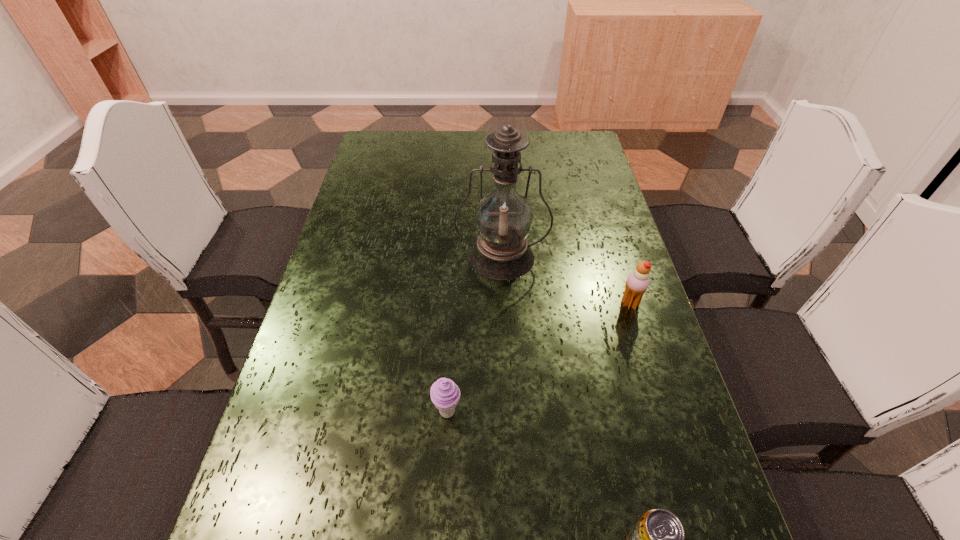
Where is `the tallest object`? the tallest object is located at coordinates (503, 218).

At what (x,y) coordinates should I click in order to perform the action: click on oil lamp. Please return your answer as a coordinate pair (x, y). This screenshot has height=540, width=960. Looking at the image, I should click on (503, 218).

Locate an element on the screen. the second farthest object is located at coordinates (638, 281).

Locate an element on the screen. This screenshot has height=540, width=960. the second tallest object is located at coordinates (638, 281).

You are a GUI agent. You are given a task and a screenshot of the screen. Output one action in this format:
    pyautogui.click(x=<x>, y=<y>)
    Task: Click on the shorter icecream
    This screenshot has height=540, width=960.
    Given the screenshot: What is the action you would take?
    pyautogui.click(x=445, y=394)

Find the location of a particular element. Image resolution: width=960 pixels, height=540 pixels. the third farthest object is located at coordinates (445, 394).

Locate an element on the screen. free region located 0.240m on the back of the oil lamp is located at coordinates (498, 188).

I want to click on free region located at the front with a straw on the second farthest object, so click(470, 304).

At what (x,y) coordinates should I click in order to perform the action: click on blank space located at the front with a straw on the second farthest object. Please return your answer as a coordinate pair (x, y). This screenshot has width=960, height=540. Looking at the image, I should click on (560, 304).

Locate an element on the screen. vacant space situated 0.060m at the front with a straw on the second farthest object is located at coordinates (595, 304).